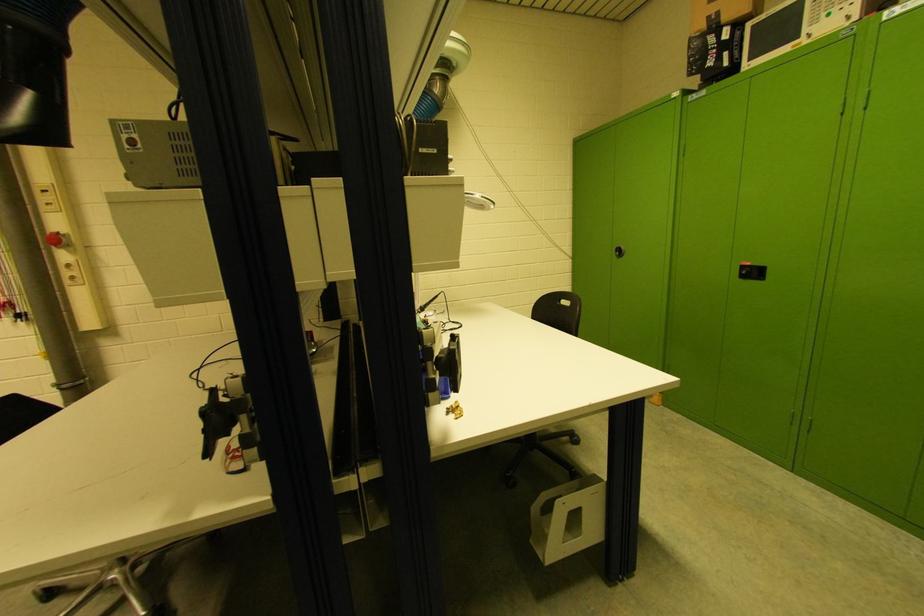
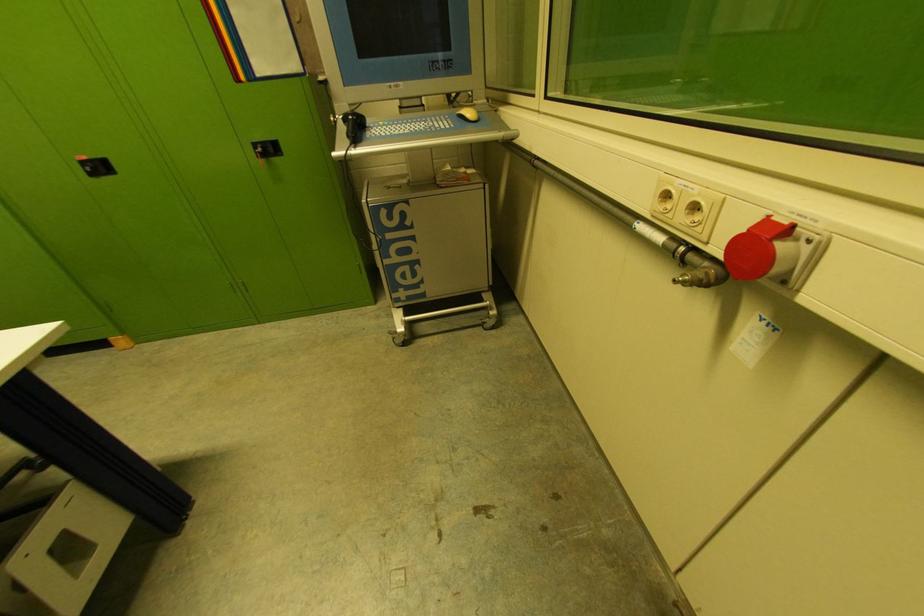
How did the camera likely rotate?

The camera rotated toward right-down.